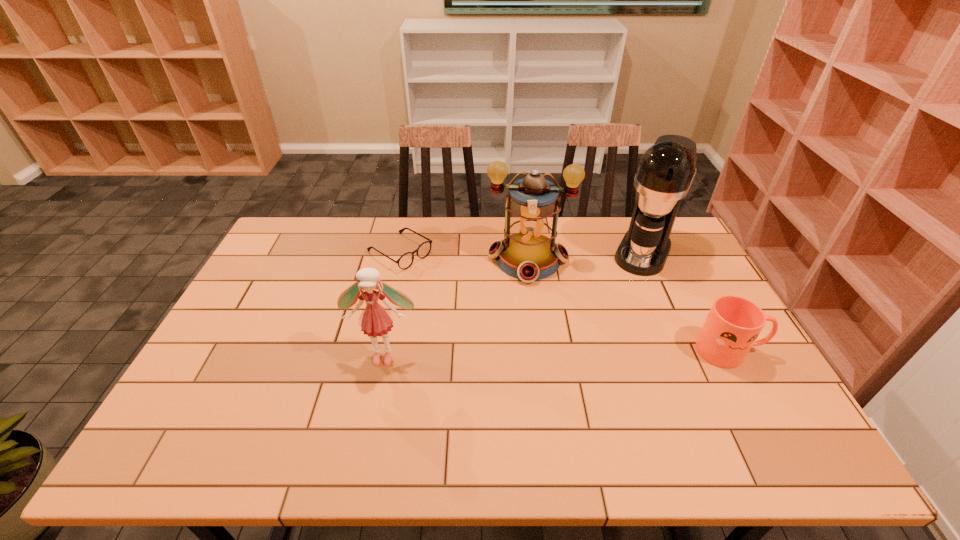
Locate an element on the screen. free space located on the front-facing side of the spectacles is located at coordinates (504, 318).

Locate an element on the screen. The height and width of the screenshot is (540, 960). blank area located 0.210m on the front-facing side of the spectacles is located at coordinates click(x=468, y=295).

Find the location of a particular element. The image size is (960, 540). vacant space located 0.400m on the front-facing side of the spectacles is located at coordinates (517, 326).

Locate an element on the screen. The image size is (960, 540). vacant point located 0.280m place cup under the spout of the coffee maker is located at coordinates (611, 328).

You are a GUI agent. You are given a task and a screenshot of the screen. Output one action in this format:
    pyautogui.click(x=<x>, y=<y>)
    Task: Click on the free space located place cup under the spout of the coffee maker
    The width and height of the screenshot is (960, 540).
    Given the screenshot: What is the action you would take?
    pyautogui.click(x=609, y=333)

Where is `free point located 0.070m place cup under the spout of the coffee maker`? This screenshot has width=960, height=540. free point located 0.070m place cup under the spout of the coffee maker is located at coordinates (631, 286).

At what (x,y) coordinates should I click in order to perform the action: click on lantern located at the far edge. Please return your answer as a coordinate pair (x, y). The height and width of the screenshot is (540, 960). Looking at the image, I should click on (528, 252).

Identify the location of spectacles that is positioned at the far edge. (405, 261).

At what (x,y) coordinates should I click in order to perform the action: click on coffee maker present at the far edge. Please return your answer as a coordinate pair (x, y). This screenshot has height=540, width=960. Looking at the image, I should click on (665, 172).

Locate an element on the screen. Image resolution: width=960 pixels, height=540 pixels. mug that is at the right edge is located at coordinates (733, 324).